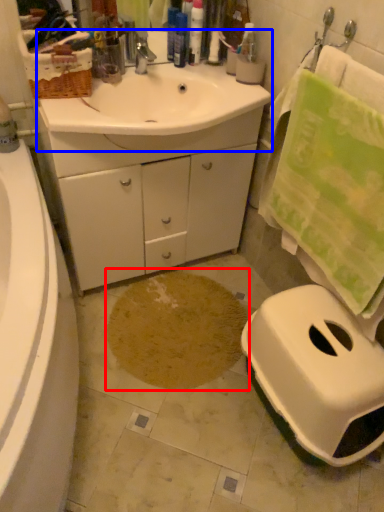
Question: Which object is further to the camera taking this photo, footprint (highlighted by a red box) or sink (highlighted by a blue box)?

Choices:
 (A) footprint
 (B) sink

Answer: (A)